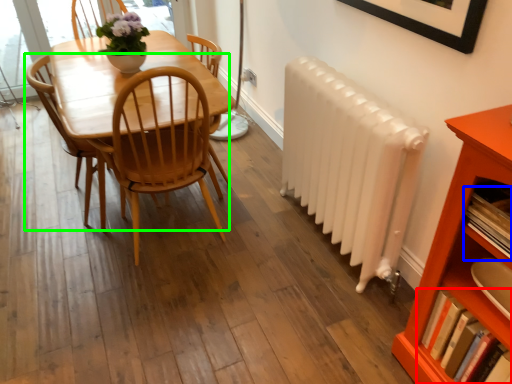
Question: Which object is the closest to the book (highlighted by a red box)? Choose among these: book (highlighted by a blue box) or chair (highlighted by a green box).

Choices:
 (A) book
 (B) chair

Answer: (A)